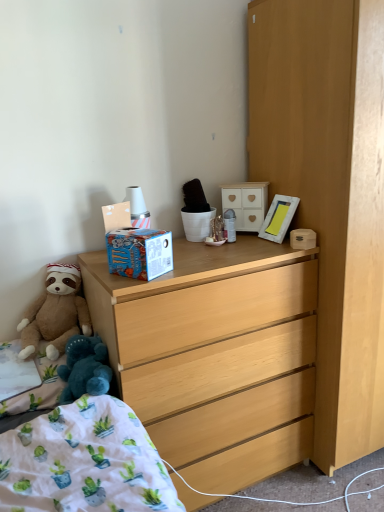
Question: Is light wood dresser at right, which is the first cabinetry in bottom-to-top order, smaller than light wood dresser at center?

Choices:
 (A) no
 (B) yes

Answer: (A)

Question: Does light wood dresser at right, the second cabinetry in the back-to-front sequence, lie in front of light wood dresser at center?

Choices:
 (A) no
 (B) yes

Answer: (B)

Question: From the image's perspective, is light wood dresser at right, marked as the second cabinetry in a top-to-bottom arrangement, over light wood dresser at center?

Choices:
 (A) no
 (B) yes

Answer: (B)

Question: Is light wood dresser at right, which ranks as the 2th cabinetry in left-to-right order, not near light wood dresser at center?

Choices:
 (A) no
 (B) yes

Answer: (A)

Question: Is light wood dresser at right, marked as the second cabinetry in a top-to-bottom arrangement, to the left of light wood dresser at center from the viewer's perspective?

Choices:
 (A) no
 (B) yes

Answer: (A)

Question: Considering the positions of point (49, 293) and point (372, 26), is point (49, 293) closer or farther from the camera than point (372, 26)?

Choices:
 (A) closer
 (B) farther

Answer: (B)

Question: Is brown plush teddy bear at lower left in front of or behind light wood dresser at right, which is the first cabinetry in bottom-to-top order, in the image?

Choices:
 (A) behind
 (B) front

Answer: (A)

Question: Is brown plush teddy bear at lower left spatially inside light wood dresser at right, which is the first cabinetry in bottom-to-top order, or outside of it?

Choices:
 (A) inside
 (B) outside

Answer: (B)

Question: In the image, is brown plush teddy bear at lower left on the left side or the right side of light wood dresser at right, which is the first cabinetry in bottom-to-top order?

Choices:
 (A) left
 (B) right

Answer: (A)

Question: From the image's perspective, is light wood dresser at center positioned above or below brown plush teddy bear at lower left?

Choices:
 (A) above
 (B) below

Answer: (B)

Question: In terms of size, does light wood dresser at center appear bigger or smaller than brown plush teddy bear at lower left?

Choices:
 (A) small
 (B) big

Answer: (B)

Question: Considering the positions of light wood dresser at center and brown plush teddy bear at lower left in the image, is light wood dresser at center wider or thinner than brown plush teddy bear at lower left?

Choices:
 (A) thin
 (B) wide

Answer: (B)

Question: In the image, is light wood dresser at center positioned in front of or behind brown plush teddy bear at lower left?

Choices:
 (A) behind
 (B) front

Answer: (B)

Question: In terms of height, does brown plush teddy bear at lower left look taller or shorter compared to white wooden picture frame at upper right?

Choices:
 (A) short
 (B) tall

Answer: (B)

Question: Considering the positions of point (46, 267) and point (276, 195), is point (46, 267) closer or farther from the camera than point (276, 195)?

Choices:
 (A) farther
 (B) closer

Answer: (B)